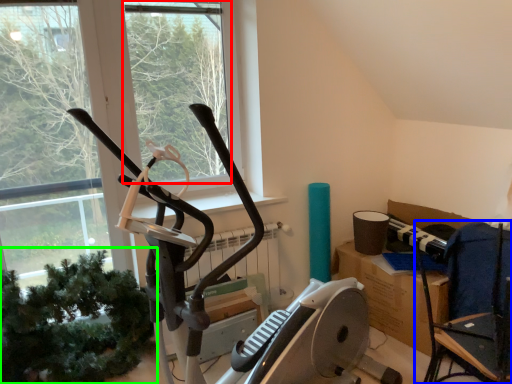
Question: Considering the real-world distances, which object is farthest from window screen (highlighted by a red box)? chair (highlighted by a blue box) or plant (highlighted by a green box)?

Choices:
 (A) chair
 (B) plant

Answer: (A)